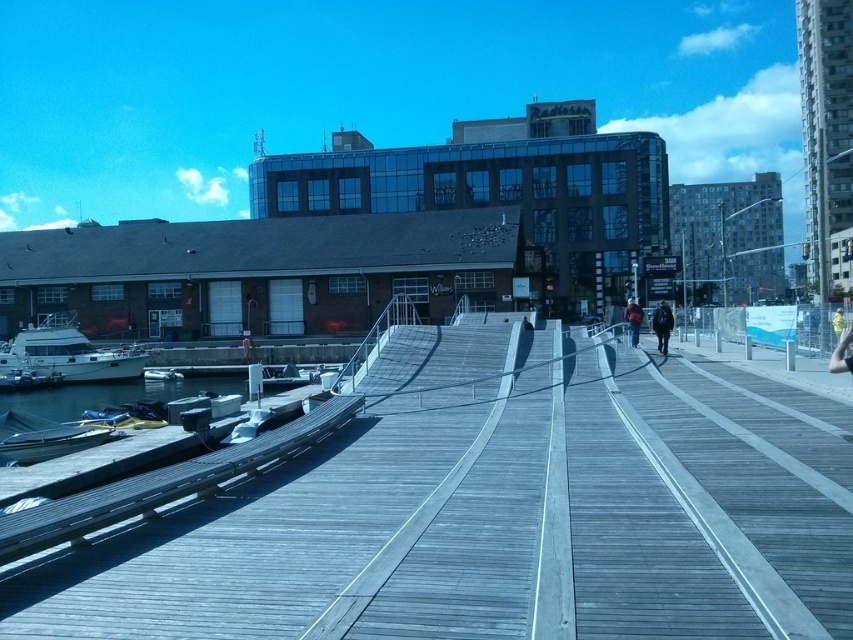
Question: Considering the real-world distances, which object is closest to the yellow reflective vest at center?

Choices:
 (A) dark blue jacket at center
 (B) black leather jacket at center
 (C) white glossy boat at lower left

Answer: (B)

Question: Is wooden planks at center to the right of black leather jacket at center from the viewer's perspective?

Choices:
 (A) yes
 (B) no

Answer: (B)

Question: Considering the real-world distances, which object is farthest from the white glossy boat at lower left?

Choices:
 (A) black leather jacket at center
 (B) wooden planks at center

Answer: (B)

Question: Does wooden planks at center appear over black leather jacket at center?

Choices:
 (A) no
 (B) yes

Answer: (A)

Question: Among these points, which one is farthest from the camera?

Choices:
 (A) (840, 321)
 (B) (666, 328)
 (C) (556, 545)

Answer: (B)

Question: Can you confirm if black leather jacket at center is wider than yellow reflective vest at center?

Choices:
 (A) no
 (B) yes

Answer: (B)